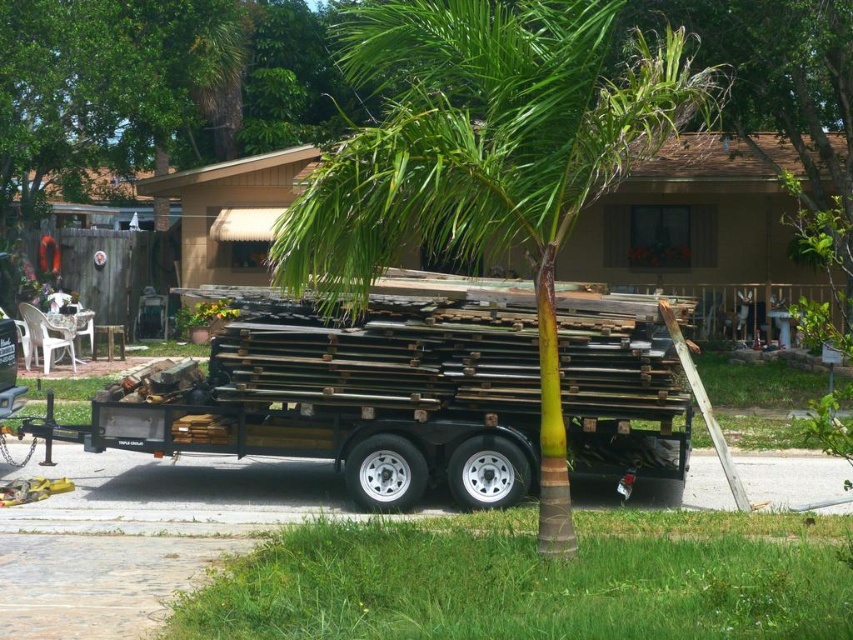
You are standing at the point marked by the coordinates point (352, 392). Looking around, you see the trailer with wooden planks at center. Which direction should you walk to reach the trailer?

Since you are already at the point representing the wooden planks at center, you are already at the trailer. No need to move.

You are standing in the driveway and want to move the yellow object near the bottom left corner to the trailer. Which direction should you move the yellow object so that it ends up between the wooden planks at center and the green leafy palm tree at center?

The wooden planks at center is on the left side of the green leafy palm tree at center, so you should move the yellow object towards the right to place it between the wooden planks at center and the green leafy palm tree at center.